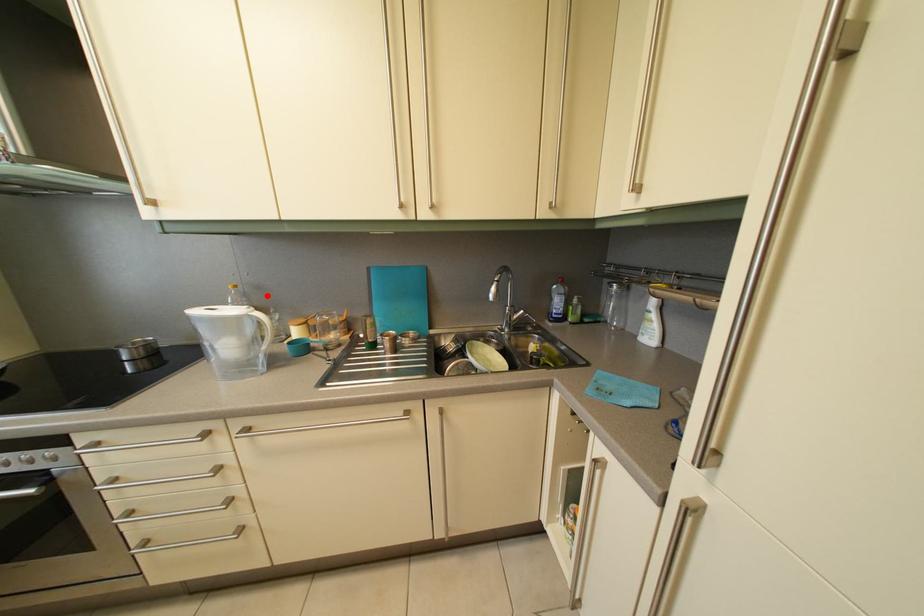
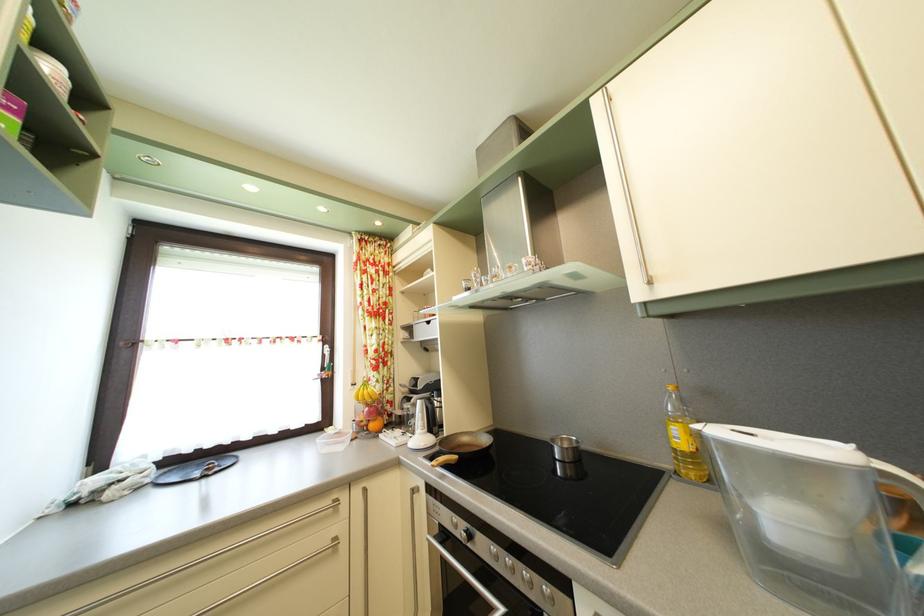
In the second image, find the point that corresponds to the highlighted location in the first image.

(715, 400)